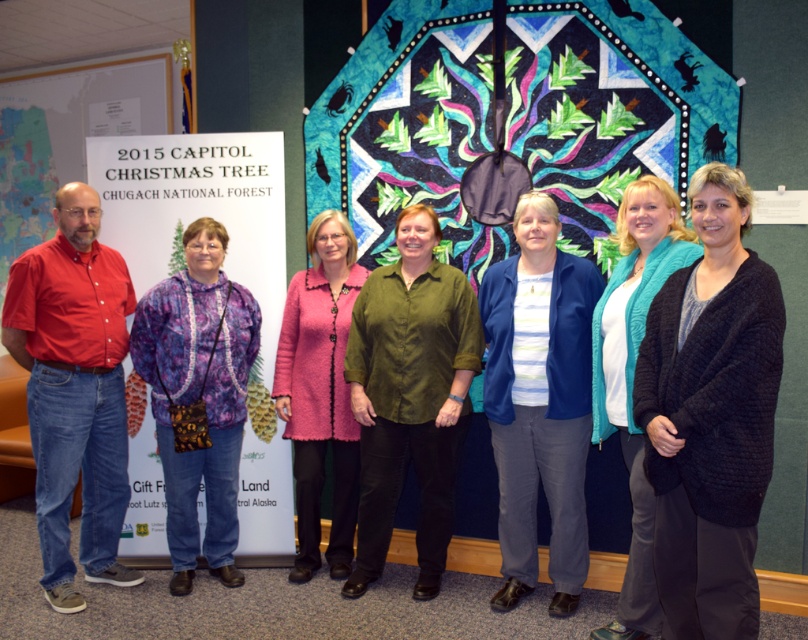
Question: Which point is closer to the camera?

Choices:
 (A) purple printed fabric at center
 (B) blue cotton pants at center
 (C) matte red shirt at left

Answer: (B)

Question: Among these objects, which one is farthest from the camera?

Choices:
 (A) black knitted cardigan at center
 (B) pink textured coat at center

Answer: (B)

Question: Does black knitted cardigan at center have a smaller size compared to purple printed fabric at center?

Choices:
 (A) no
 (B) yes

Answer: (B)

Question: Which object is closer to the camera taking this photo?

Choices:
 (A) black knitted cardigan at center
 (B) pink textured coat at center

Answer: (A)

Question: Is black knitted cardigan at center thinner than blue cotton pants at center?

Choices:
 (A) yes
 (B) no

Answer: (A)

Question: Does black knitted cardigan at center appear under blue cotton pants at center?

Choices:
 (A) yes
 (B) no

Answer: (B)